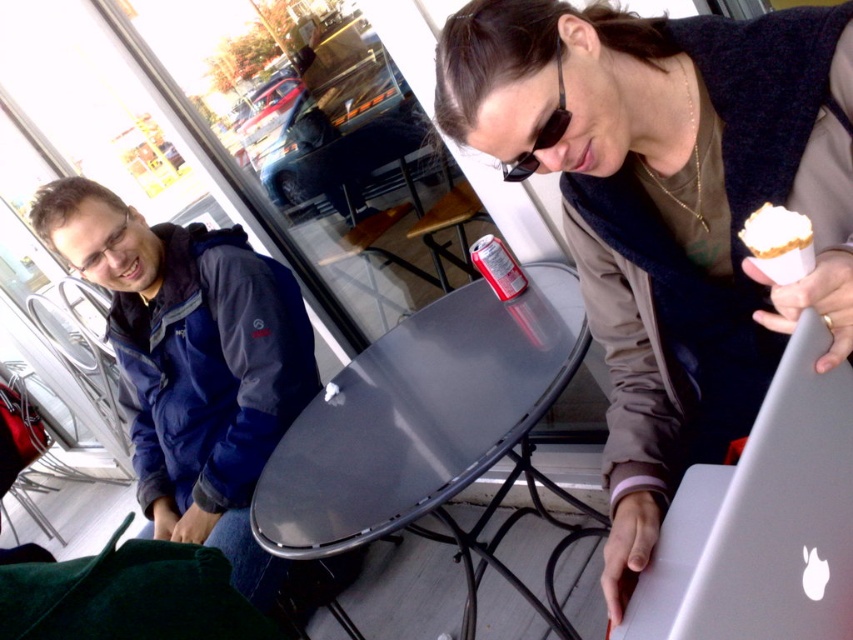
You are a customer at this outdoor cafe and want to place your ice cream cone on the table to free up your hand. Can you put the white paper ice cream cone at upper right directly onto the glossy metal table at center without it falling off?

The glossy metal table at center is positioned under white paper ice cream cone at upper right, so yes, you can place the white paper ice cream cone at upper right directly onto the glossy metal table at center without it falling off because the table is located beneath the cone.

You are a photographer trying to capture a candid shot of the matte black jacket at center and the sunglasses at center. Since you want to ensure both objects are in focus, you need to know which one is bigger. Which object is larger?

The matte black jacket at center is larger in size than sunglasses at center, so you should adjust your camera settings to focus on the matte black jacket at center since it is the bigger object.

You are a photographer trying to capture a candid shot of the matte black jacket at center and the sunglasses at center. Which object should you focus on first to ensure both are in sharp focus?

The matte black jacket at center is closer to the viewer than the sunglasses at center, so focusing on the matte black jacket at center will ensure both are in sharp focus.